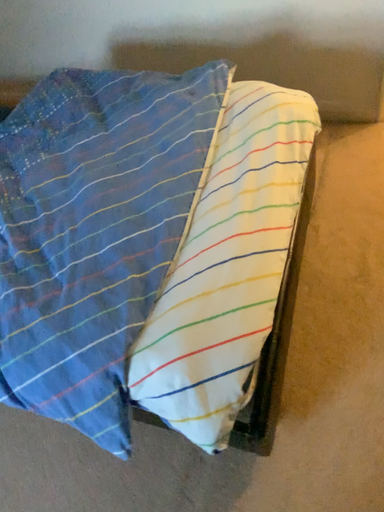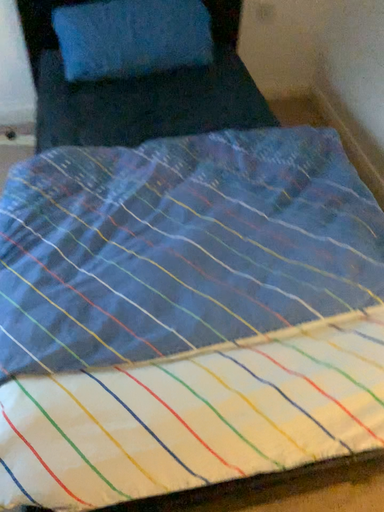
Question: How did the camera likely rotate when shooting the video?

Choices:
 (A) rotated downward
 (B) rotated upward

Answer: (B)